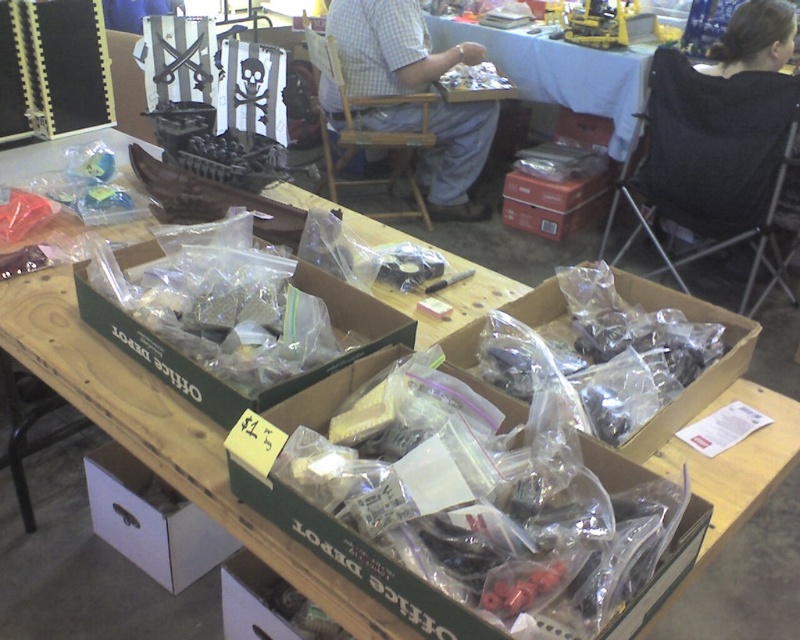
Which is more to the right, clear plastic box at center or white cardboard box at lower left?

clear plastic box at center

Does clear plastic box at center have a lesser height compared to white cardboard box at lower left?

Correct, clear plastic box at center is not as tall as white cardboard box at lower left.

Is point (332, 300) in front of point (148, 573)?

Yes, point (332, 300) is closer to viewer.

Where is `clear plastic box at center`? The width and height of the screenshot is (800, 640). clear plastic box at center is located at coordinates (218, 380).

Is point (102, 515) behind point (458, 67)?

No, it is not.

Who is more distant from viewer, [170,550] or [458,65]?

The point [458,65] is behind.

The image size is (800, 640). In order to click on white cardboard box at lower left in this screenshot , I will do `click(152, 518)`.

Which is more to the left, checkered fabric shirt at center or clear plastic box at center?

clear plastic box at center

Is checkered fabric shirt at center taller than clear plastic box at center?

Indeed, checkered fabric shirt at center has a greater height compared to clear plastic box at center.

Is point (424, 168) positioned in front of point (352, 316)?

No, it is behind (352, 316).

The height and width of the screenshot is (640, 800). I want to click on checkered fabric shirt at center, so click(x=389, y=48).